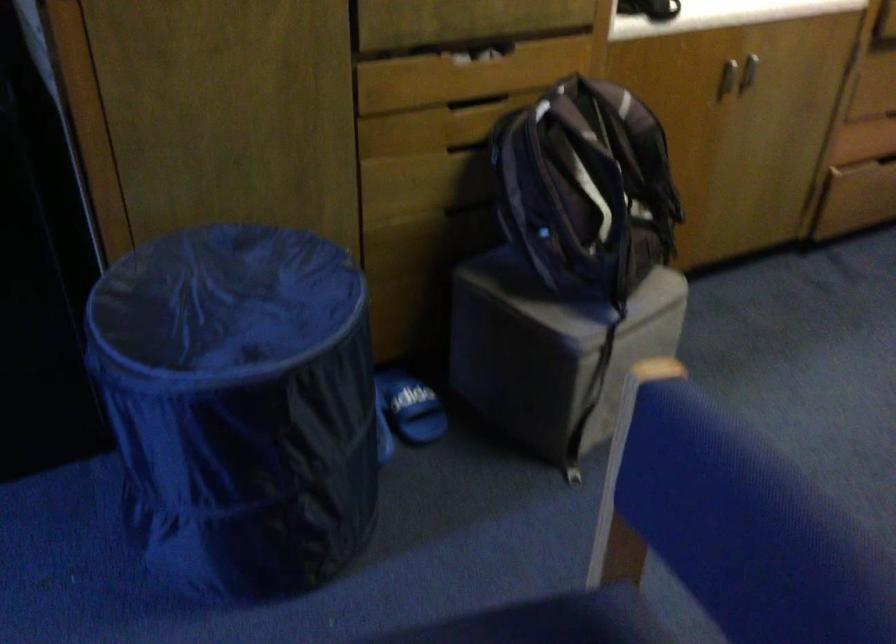
The width and height of the screenshot is (896, 644). What do you see at coordinates (410, 406) in the screenshot?
I see `the blue slide sandal` at bounding box center [410, 406].